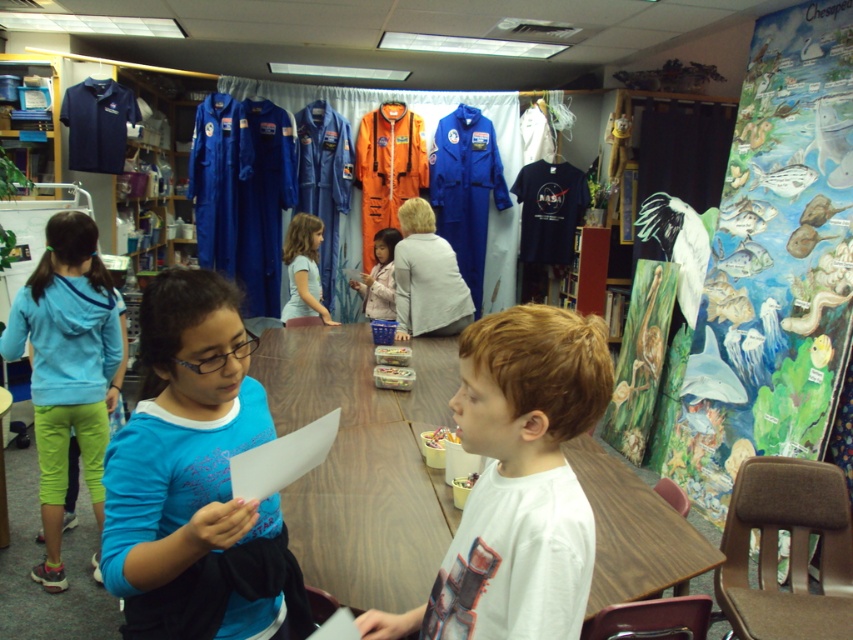
Question: Considering the relative positions of light blue fleece jacket at lower left and light blue fabric shirt at center in the image provided, where is light blue fleece jacket at lower left located with respect to light blue fabric shirt at center?

Choices:
 (A) right
 (B) left

Answer: (B)

Question: Which of the following is the closest to the observer?

Choices:
 (A) blue matte shirt at center
 (B) white matte shirt at center
 (C) light blue fleece jacket at lower left

Answer: (B)

Question: Can you confirm if blue matte shirt at center is thinner than light blue fleece jacket at lower left?

Choices:
 (A) no
 (B) yes

Answer: (B)

Question: Among these points, which one is nearest to the camera?

Choices:
 (A) (297, 236)
 (B) (151, 454)
 (C) (59, 406)

Answer: (B)

Question: Does blue matte shirt at center appear under light blue fleece jacket at lower left?

Choices:
 (A) yes
 (B) no

Answer: (A)

Question: Considering the real-world distances, which object is closest to the white matte shirt at center?

Choices:
 (A) light blue fleece jacket at lower left
 (B) light blue fabric shirt at center
 (C) fluffy pink jacket at center

Answer: (A)